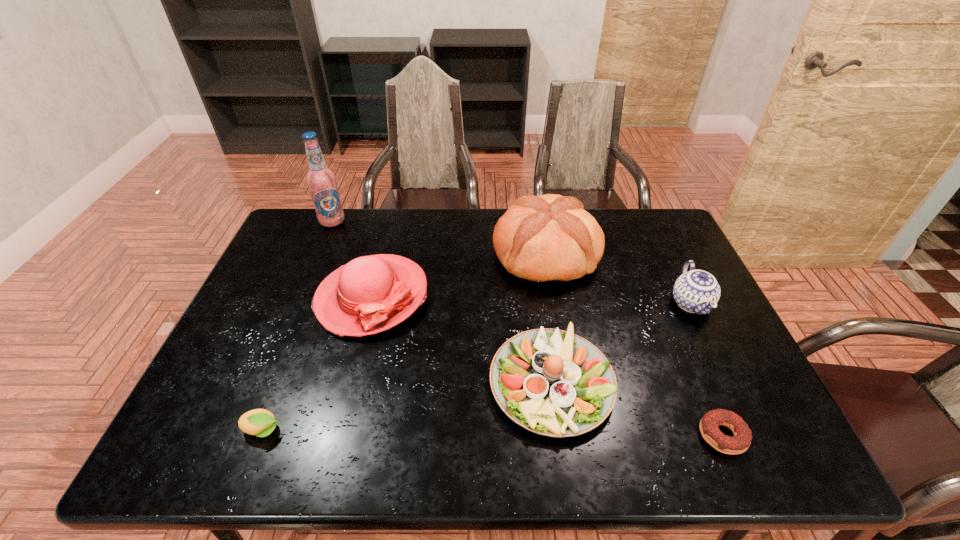
Where is `alcohol`? alcohol is located at coordinates (321, 181).

Locate an element on the screen. The width and height of the screenshot is (960, 540). bread is located at coordinates (550, 237).

At what (x,y) coordinates should I click in order to perform the action: click on hat. Please return your answer as a coordinate pair (x, y). Looking at the image, I should click on (370, 294).

At what (x,y) coordinates should I click in order to perform the action: click on chinaware. Please return your answer as a coordinate pair (x, y). Looking at the image, I should click on (696, 291).

You are a GUI agent. You are given a task and a screenshot of the screen. Output one action in this format:
    pyautogui.click(x=<x>, y=<y>)
    Task: Click on the third shortest object
    
    Given the screenshot: What is the action you would take?
    pyautogui.click(x=552, y=382)

At what (x,y) coordinates should I click in order to perform the action: click on the sixth tallest object. Please return your answer as a coordinate pair (x, y). The image size is (960, 540). Looking at the image, I should click on (260, 422).

Locate an element on the screen. the shortest object is located at coordinates (709, 425).

At what (x,y) coordinates should I click in order to perform the action: click on free spot located 0.360m on the front of the tallest object. Please return your answer as a coordinate pair (x, y). Looking at the image, I should click on (298, 306).

The width and height of the screenshot is (960, 540). I want to click on vacant space located 0.390m on the front of the sixth shortest object, so 572,410.

Find the location of a particular element. This screenshot has height=540, width=960. free space located at the front of the hat with a bow is located at coordinates (354, 367).